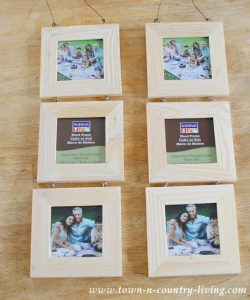
Where is `wooden surface`? wooden surface is located at coordinates [x=137, y=164].